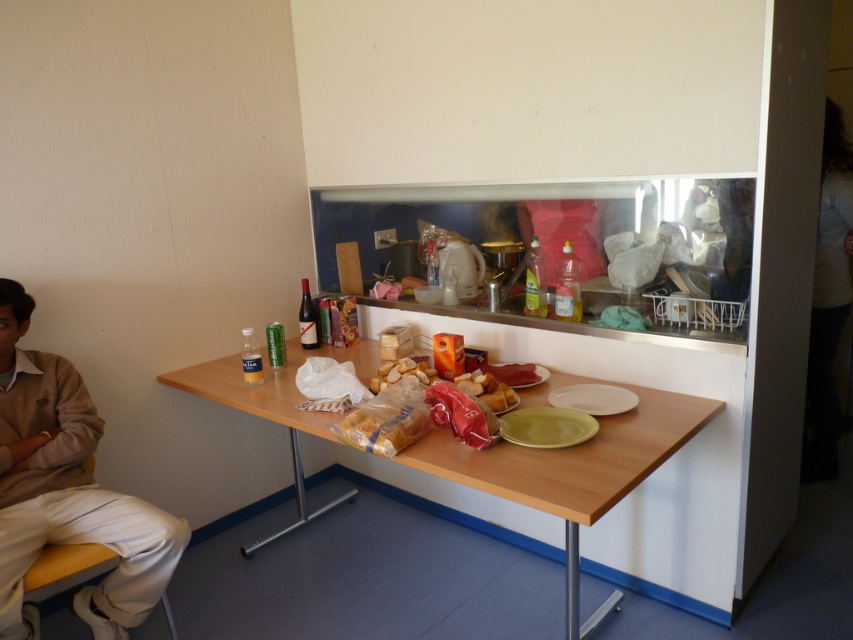
Question: Observing the image, what is the correct spatial positioning of white matte plate at center in reference to matte yellow plate at center?

Choices:
 (A) below
 (B) above

Answer: (A)

Question: Which point appears farthest from the camera in this image?

Choices:
 (A) (341, 436)
 (B) (22, 566)

Answer: (A)

Question: Observing the image, what is the correct spatial positioning of wooden table at center in reference to golden brown bread at center?

Choices:
 (A) above
 (B) below

Answer: (B)

Question: Can you confirm if golden bread loaf at center is positioned above golden brown bread at center?

Choices:
 (A) yes
 (B) no

Answer: (B)

Question: Which object is positioned closest to the golden brown bread at center?

Choices:
 (A) wooden table at center
 (B) green matte plate at center
 (C) beige fabric pants at lower left
 (D) golden bread loaf at center

Answer: (B)

Question: Which point is farther to the camera?

Choices:
 (A) (651, 400)
 (B) (20, 358)
 (C) (488, 396)

Answer: (B)